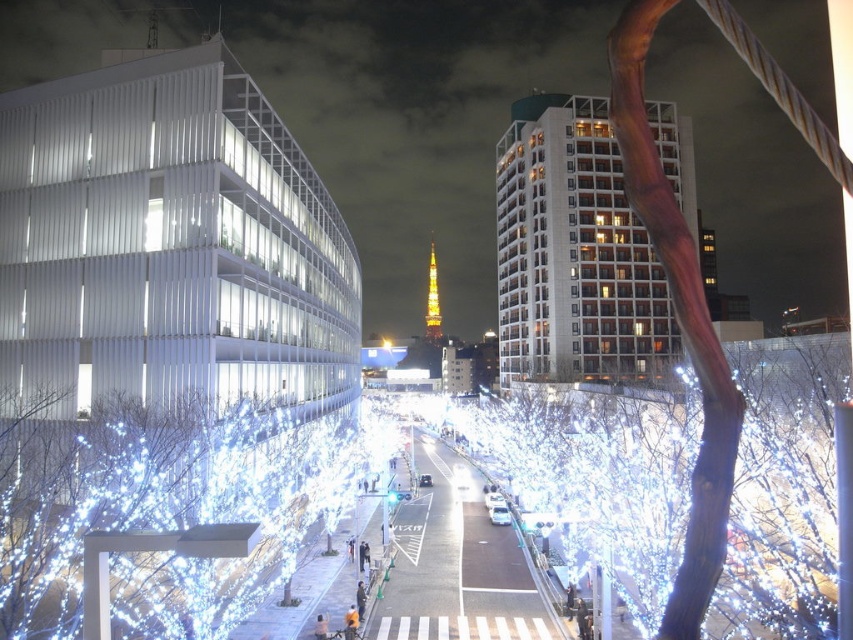
Question: Can you confirm if illuminated white branches at center is positioned above illuminated white branches at lower left?

Choices:
 (A) no
 (B) yes

Answer: (B)

Question: Which point is closer to the camera?

Choices:
 (A) illuminated white branches at center
 (B) illuminated white branches at lower left

Answer: (A)

Question: Which object is farther from the camera taking this photo?

Choices:
 (A) illuminated white branches at lower left
 (B) illuminated white branches at center

Answer: (A)

Question: Is illuminated white branches at center closer to the viewer compared to illuminated white branches at lower left?

Choices:
 (A) yes
 (B) no

Answer: (A)

Question: Does illuminated white branches at center have a smaller size compared to illuminated white branches at lower left?

Choices:
 (A) yes
 (B) no

Answer: (B)